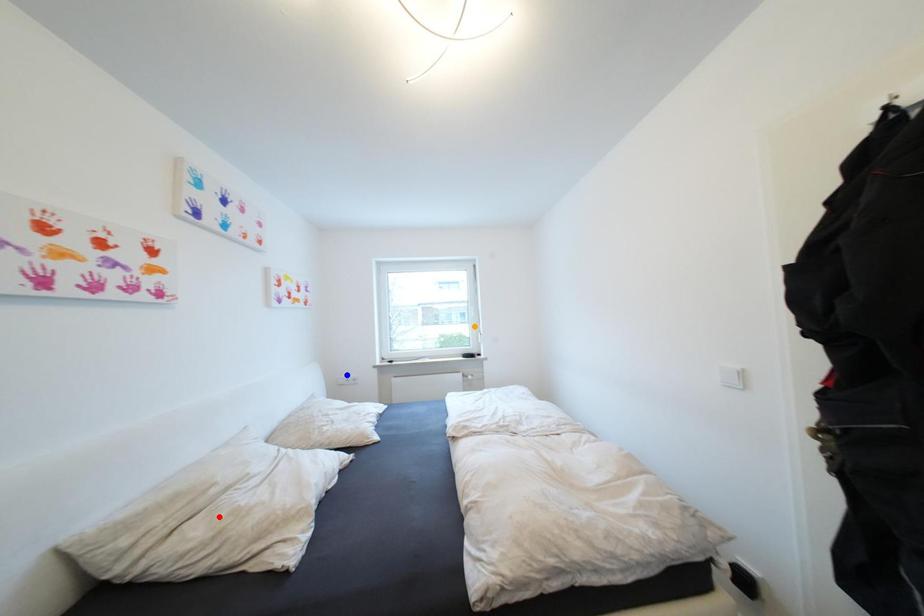
Order these from nearest to farthest:
1. orange point
2. blue point
3. red point

red point
blue point
orange point